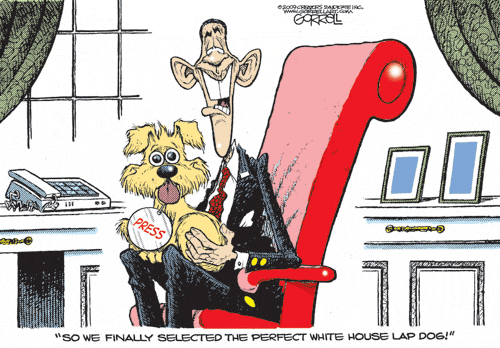
Locate an element on the screen. Image resolution: width=500 pixels, height=348 pixels. home phone is located at coordinates (40, 188), (77, 191).